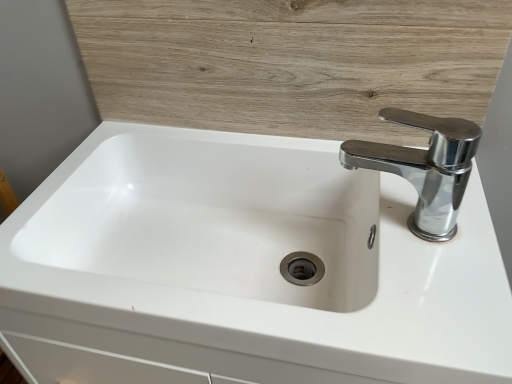
Measure the distance between point (230,257) and camera.

The distance of point (230,257) from camera is 62.20 centimeters.

Where is `chrome metallic faucet at upper right`? chrome metallic faucet at upper right is located at coordinates (424, 167).

Where is `wooden panel at upper center`? This screenshot has height=384, width=512. wooden panel at upper center is located at coordinates (292, 63).

Does white glossy sink at center lie in front of chrome metallic faucet at upper right?

That is True.

How distant is white glossy sink at center from chrome metallic faucet at upper right?

7.90 inches.

In the image, is white glossy sink at center on the left side or the right side of chrome metallic faucet at upper right?

In the image, white glossy sink at center appears on the left side of chrome metallic faucet at upper right.

Looking at this image, which is closer to the camera, (312,321) or (441,170)?

The point (312,321) is more forward.

Is chrome metallic faucet at upper right bigger than white glossy sink at center?

Incorrect, chrome metallic faucet at upper right is not larger than white glossy sink at center.

Considering the sizes of objects chrome metallic faucet at upper right and white glossy sink at center in the image provided, who is shorter, chrome metallic faucet at upper right or white glossy sink at center?

chrome metallic faucet at upper right.

Considering the positions of point (399, 172) and point (471, 301), is point (399, 172) closer or farther from the camera than point (471, 301)?

Clearly, point (399, 172) is more distant from the camera than point (471, 301).

Looking at this image, from the image's perspective, which is below, wooden panel at upper center or chrome metallic faucet at upper right?

chrome metallic faucet at upper right.

Does wooden panel at upper center have a greater height compared to chrome metallic faucet at upper right?

Yes.

From the picture: How different are the orientations of wooden panel at upper center and chrome metallic faucet at upper right in degrees?

There is a 90.4-degree angle between the facing directions of wooden panel at upper center and chrome metallic faucet at upper right.

Is white glossy sink at center not within wooden panel at upper center?

That's correct, white glossy sink at center is outside of wooden panel at upper center.

Is white glossy sink at center further to the viewer compared to wooden panel at upper center?

That is False.

Does point (425, 159) appear closer or farther from the camera than point (144, 40)?

Clearly, point (425, 159) is more distant from the camera than point (144, 40).

Considering the relative sizes of white glossy sink at center and wooden panel at upper center in the image provided, is white glossy sink at center thinner than wooden panel at upper center?

In fact, white glossy sink at center might be wider than wooden panel at upper center.

Does point (415, 188) appear closer or farther from the camera than point (297, 96)?

Point (415, 188) is closer to the camera than point (297, 96).

In the scene shown: Which object is positioned more to the left, chrome metallic faucet at upper right or wooden panel at upper center?

From the viewer's perspective, wooden panel at upper center appears more on the left side.

Does chrome metallic faucet at upper right turn towards wooden panel at upper center?

No, chrome metallic faucet at upper right is not aimed at wooden panel at upper center.

Which is more to the left, wooden panel at upper center or white glossy sink at center?

white glossy sink at center is more to the left.

From a real-world perspective, which object rests below the other?

From a 3D spatial view, white glossy sink at center is below.

Is point (322, 41) positioned behind point (405, 318)?

Yes, point (322, 41) is behind point (405, 318).

Who is bigger, wooden panel at upper center or white glossy sink at center?

Bigger between the two is white glossy sink at center.

Locate an element on the screen. sink in front of the chrome metallic faucet at upper right is located at coordinates (244, 268).

Identify the location of sink on the left of chrome metallic faucet at upper right. The height and width of the screenshot is (384, 512). (244, 268).

From the image, which object appears to be farther from wooden panel at upper center, white glossy sink at center or chrome metallic faucet at upper right?

Based on the image, white glossy sink at center appears to be further to wooden panel at upper center.

In the scene shown: Based on their spatial positions, is white glossy sink at center or wooden panel at upper center closer to chrome metallic faucet at upper right?

Based on the image, wooden panel at upper center appears to be nearer to chrome metallic faucet at upper right.

From the image, which object appears to be nearer to white glossy sink at center, chrome metallic faucet at upper right or wooden panel at upper center?

The object closer to white glossy sink at center is wooden panel at upper center.

Based on their spatial positions, is wooden panel at upper center or chrome metallic faucet at upper right further from white glossy sink at center?

chrome metallic faucet at upper right.

Estimate the real-world distances between objects in this image. Which object is closer to chrome metallic faucet at upper right, wooden panel at upper center or white glossy sink at center?

Based on the image, wooden panel at upper center appears to be nearer to chrome metallic faucet at upper right.

Which object lies nearer to the anchor point wooden panel at upper center, chrome metallic faucet at upper right or white glossy sink at center?

chrome metallic faucet at upper right.

The height and width of the screenshot is (384, 512). I want to click on tap between wooden panel at upper center and white glossy sink at center in the vertical direction, so click(424, 167).